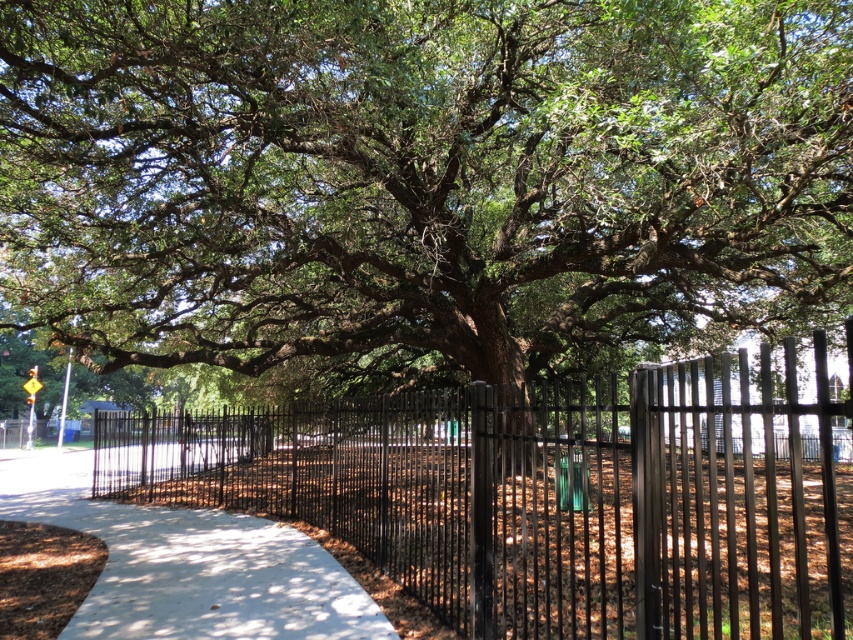
You are a gardener planning to install a new fence. You observe the black metal fence at center and the white concrete pavement at center in the scene. Which object is bigger in size?

The black metal fence at center is larger in size than the white concrete pavement at center.

You are a pedestrian walking along the sidewalk and see the green leafy tree at center and the white concrete pavement at center. Which object is positioned to the right side from your perspective?

The green leafy tree at center is to the right of the white concrete pavement at center, so the green leafy tree at center is positioned to the right side from your perspective.